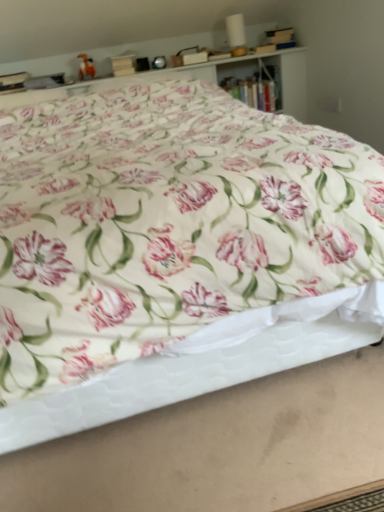
Based on the photo, measure the distance between point (249, 81) and camera.

Point (249, 81) is 2.97 meters from camera.

This screenshot has height=512, width=384. What are the coordinates of `wooden bookshelf at upper center` in the screenshot? It's located at (257, 88).

Where is `white quilted mattress at lower center`? The height and width of the screenshot is (512, 384). white quilted mattress at lower center is located at coordinates (205, 362).

Considering the relative sizes of white quilted mattress at lower center and floral fabric bed at center in the image provided, is white quilted mattress at lower center thinner than floral fabric bed at center?

Yes.

From the image's perspective, would you say white quilted mattress at lower center is positioned over floral fabric bed at center?

No, from the image's perspective, white quilted mattress at lower center is not above floral fabric bed at center.

Could you tell me if white quilted mattress at lower center is facing floral fabric bed at center?

No, white quilted mattress at lower center is not facing towards floral fabric bed at center.

Does floral fabric bed at center have a larger size compared to white quilted mattress at lower center?

Yes.

What's the angular difference between floral fabric bed at center and white quilted mattress at lower center's facing directions?

90 degrees separate the facing orientations of floral fabric bed at center and white quilted mattress at lower center.

From a real-world perspective, is floral fabric bed at center positioned under white quilted mattress at lower center based on gravity?

No.

In the scene shown: From the image's perspective, is floral fabric bed at center above or below white quilted mattress at lower center?

Clearly, from the image's perspective, floral fabric bed at center is above white quilted mattress at lower center.

Is white quilted mattress at lower center further to camera compared to wooden bookshelf at upper center?

No.

From a real-world perspective, is white quilted mattress at lower center physically located above or below wooden bookshelf at upper center?

white quilted mattress at lower center is below wooden bookshelf at upper center.

Is white quilted mattress at lower center in contact with wooden bookshelf at upper center?

white quilted mattress at lower center is not next to wooden bookshelf at upper center, and they're not touching.

Between point (270, 104) and point (228, 341), which one is positioned in front?

The point (228, 341) is in front.

Can you confirm if wooden bookshelf at upper center is positioned to the right of white quilted mattress at lower center?

Yes.

Which is in front, wooden bookshelf at upper center or white quilted mattress at lower center?

white quilted mattress at lower center is more forward.

Which point is more distant from viewer, (7, 391) or (271, 71)?

The point (271, 71) is farther from the camera.

Is floral fabric bed at center looking in the opposite direction of wooden bookshelf at upper center?

No, floral fabric bed at center's orientation is not away from wooden bookshelf at upper center.

Is floral fabric bed at center situated inside wooden bookshelf at upper center or outside?

floral fabric bed at center is located beyond the bounds of wooden bookshelf at upper center.

Which of these two, wooden bookshelf at upper center or floral fabric bed at center, is smaller?

With smaller size is wooden bookshelf at upper center.

From a real-world perspective, who is located higher, wooden bookshelf at upper center or floral fabric bed at center?

In real-world perspective, wooden bookshelf at upper center is above.

Based on the photo, between wooden bookshelf at upper center and floral fabric bed at center, which one has larger width?

With larger width is floral fabric bed at center.

Is point (243, 92) closer or farther from the camera than point (367, 276)?

Point (243, 92) is farther from the camera than point (367, 276).

The image size is (384, 512). I want to click on bed frame located behind the floral fabric bed at center, so click(x=205, y=362).

At what (x,y) coordinates should I click in order to perform the action: click on bed frame below the floral fabric bed at center (from a real-world perspective). Please return your answer as a coordinate pair (x, y). Image resolution: width=384 pixels, height=512 pixels. Looking at the image, I should click on (205, 362).

When comparing their distances from white quilted mattress at lower center, does wooden bookshelf at upper center or floral fabric bed at center seem closer?

floral fabric bed at center is closer to white quilted mattress at lower center.

Based on their spatial positions, is floral fabric bed at center or wooden bookshelf at upper center further from white quilted mattress at lower center?

Among the two, wooden bookshelf at upper center is located further to white quilted mattress at lower center.

From the image, which object appears to be farther from wooden bookshelf at upper center, white quilted mattress at lower center or floral fabric bed at center?

white quilted mattress at lower center is further to wooden bookshelf at upper center.

Based on their spatial positions, is floral fabric bed at center or white quilted mattress at lower center closer to wooden bookshelf at upper center?

floral fabric bed at center is positioned closer to the anchor wooden bookshelf at upper center.

Based on their spatial positions, is wooden bookshelf at upper center or white quilted mattress at lower center further from floral fabric bed at center?

Among the two, wooden bookshelf at upper center is located further to floral fabric bed at center.

Considering their positions, is white quilted mattress at lower center positioned further to floral fabric bed at center than wooden bookshelf at upper center?

wooden bookshelf at upper center lies further to floral fabric bed at center than the other object.

Image resolution: width=384 pixels, height=512 pixels. Identify the location of bed frame between floral fabric bed at center and wooden bookshelf at upper center from front to back. (205, 362).